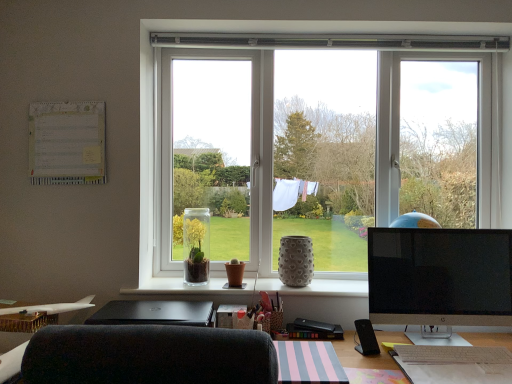
Identify the location of vacant space situated on the left part of clear glass vase at center, the 3th vase positioned from the right. Image resolution: width=512 pixels, height=384 pixels. (163, 281).